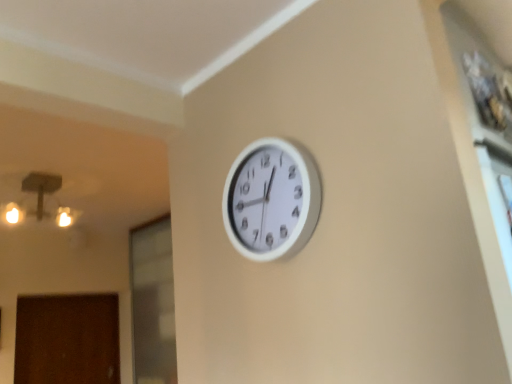
Question: Is there a large distance between brown matte door at lower left and transparent glass door at lower left?

Choices:
 (A) no
 (B) yes

Answer: (A)

Question: From a real-world perspective, is brown matte door at lower left located beneath transparent glass door at lower left?

Choices:
 (A) no
 (B) yes

Answer: (B)

Question: Can you confirm if brown matte door at lower left is thinner than transparent glass door at lower left?

Choices:
 (A) no
 (B) yes

Answer: (B)

Question: Can transparent glass door at lower left be found inside brown matte door at lower left?

Choices:
 (A) yes
 (B) no

Answer: (B)

Question: Can you confirm if brown matte door at lower left is smaller than transparent glass door at lower left?

Choices:
 (A) no
 (B) yes

Answer: (B)

Question: Is brown matte door at lower left oriented away from transparent glass door at lower left?

Choices:
 (A) yes
 (B) no

Answer: (B)

Question: Considering the relative positions of brown matte door at lower left and white plastic clock at upper center in the image provided, is brown matte door at lower left to the left of white plastic clock at upper center from the viewer's perspective?

Choices:
 (A) yes
 (B) no

Answer: (A)

Question: Considering the relative sizes of brown matte door at lower left and white plastic clock at upper center in the image provided, is brown matte door at lower left bigger than white plastic clock at upper center?

Choices:
 (A) yes
 (B) no

Answer: (A)

Question: Considering the relative positions of brown matte door at lower left and white plastic clock at upper center in the image provided, is brown matte door at lower left behind white plastic clock at upper center?

Choices:
 (A) no
 (B) yes

Answer: (B)

Question: Is brown matte door at lower left facing away from white plastic clock at upper center?

Choices:
 (A) no
 (B) yes

Answer: (A)

Question: From the image's perspective, is brown matte door at lower left over white plastic clock at upper center?

Choices:
 (A) yes
 (B) no

Answer: (B)

Question: Considering the relative sizes of brown matte door at lower left and white plastic clock at upper center in the image provided, is brown matte door at lower left thinner than white plastic clock at upper center?

Choices:
 (A) yes
 (B) no

Answer: (B)

Question: Is white plastic clock at upper center looking in the opposite direction of brown matte door at lower left?

Choices:
 (A) no
 (B) yes

Answer: (A)